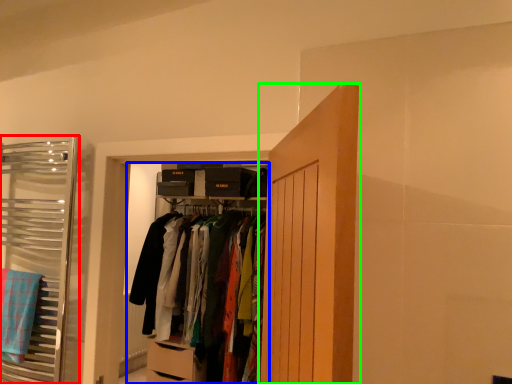
Question: Considering the real-world distances, which object is farthest from closet (highlighted by a red box)? closet (highlighted by a blue box) or door (highlighted by a green box)?

Choices:
 (A) closet
 (B) door

Answer: (B)